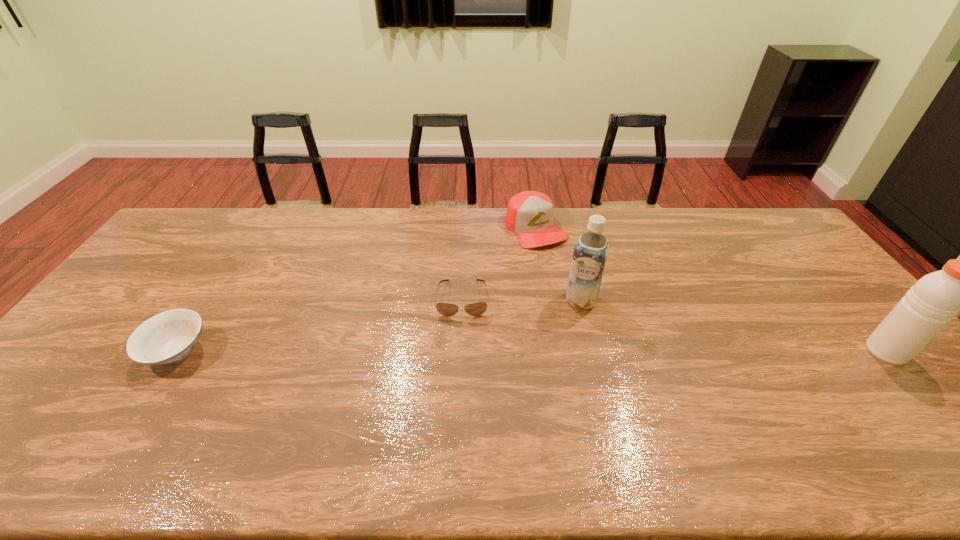
Locate an element on the screen. Image resolution: width=960 pixels, height=540 pixels. vacant space on the desktop that is between the leftmost object and the rightmost object and is positioned on the front-facing side of the baseball cap is located at coordinates (635, 351).

At what (x,y) coordinates should I click in order to perform the action: click on vacant space on the desktop that is between the leftmost object and the shaker and is positioned on the label of the soya milk. Please return your answer as a coordinate pair (x, y). This screenshot has height=540, width=960. Looking at the image, I should click on (564, 351).

The height and width of the screenshot is (540, 960). I want to click on vacant space on the desktop that is between the leftmost object and the rightmost object and is positioned on the front-facing side of the sunglasses, so click(x=462, y=351).